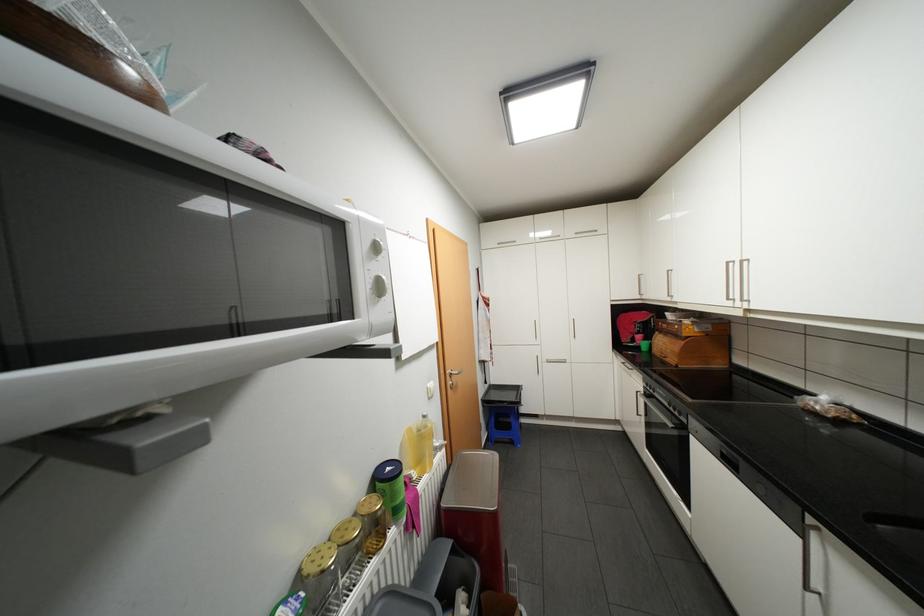
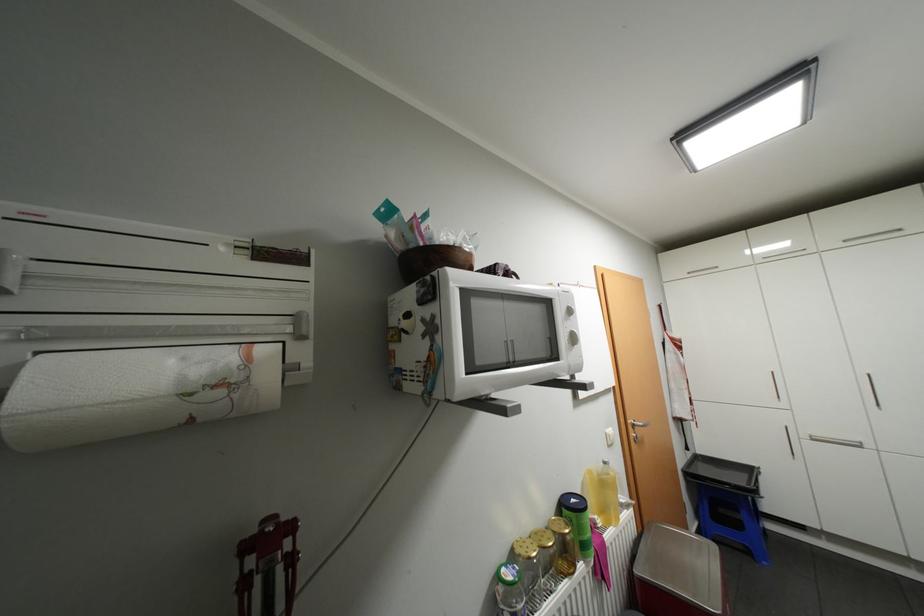
Find the pixel in the second image that matches [377,285] in the first image.

(575, 337)